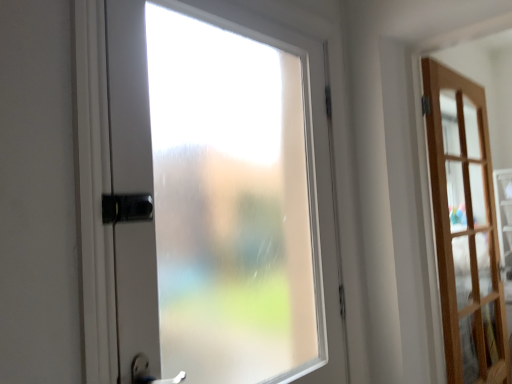
Question: From a real-world perspective, does light brown wooden door at right, which appears as the 1th door when viewed from the right, sit lower than frosted glass door at center, arranged as the 2th door when viewed from the right?

Choices:
 (A) yes
 (B) no

Answer: (A)

Question: Is frosted glass door at center, which ranks as the 2th door in back-to-front order, at the back of light brown wooden door at right, the 1th door in the back-to-front sequence?

Choices:
 (A) yes
 (B) no

Answer: (B)

Question: Considering the relative sizes of light brown wooden door at right, which ranks as the second door in front-to-back order, and frosted glass door at center, the 1th door viewed from the front, in the image provided, is light brown wooden door at right, which ranks as the second door in front-to-back order, wider than frosted glass door at center, the 1th door viewed from the front,?

Choices:
 (A) yes
 (B) no

Answer: (A)

Question: Is light brown wooden door at right, which ranks as the second door in front-to-back order, outside frosted glass door at center, which ranks as the 2th door in back-to-front order?

Choices:
 (A) yes
 (B) no

Answer: (A)

Question: From a real-world perspective, does light brown wooden door at right, the 1th door in the back-to-front sequence, stand above frosted glass door at center, which ranks as the 2th door in back-to-front order?

Choices:
 (A) no
 (B) yes

Answer: (A)

Question: Can you confirm if light brown wooden door at right, the 2th door from the left, is positioned to the right of frosted glass door at center, arranged as the 2th door when viewed from the right?

Choices:
 (A) no
 (B) yes

Answer: (B)

Question: Is frosted glass door at center, the 1th door viewed from the front, shorter than light brown wooden door at right, the 1th door in the back-to-front sequence?

Choices:
 (A) yes
 (B) no

Answer: (A)

Question: Is frosted glass door at center, marked as the 1th door in a left-to-right arrangement, far from light brown wooden door at right, the 2th door from the left?

Choices:
 (A) no
 (B) yes

Answer: (A)

Question: Is frosted glass door at center, the 1th door viewed from the front, completely or partially outside of light brown wooden door at right, the 1th door in the back-to-front sequence?

Choices:
 (A) yes
 (B) no

Answer: (A)

Question: Does frosted glass door at center, which ranks as the 2th door in back-to-front order, have a greater height compared to light brown wooden door at right, which appears as the 1th door when viewed from the right?

Choices:
 (A) yes
 (B) no

Answer: (B)

Question: Is frosted glass door at center, the 1th door viewed from the front, directly adjacent to light brown wooden door at right, the 1th door in the back-to-front sequence?

Choices:
 (A) no
 (B) yes

Answer: (A)

Question: Can you confirm if frosted glass door at center, the 1th door viewed from the front, is positioned to the left of light brown wooden door at right, which ranks as the second door in front-to-back order?

Choices:
 (A) yes
 (B) no

Answer: (A)

Question: Is frosted glass door at center, the 1th door viewed from the front, bigger or smaller than light brown wooden door at right, which ranks as the second door in front-to-back order?

Choices:
 (A) big
 (B) small

Answer: (B)